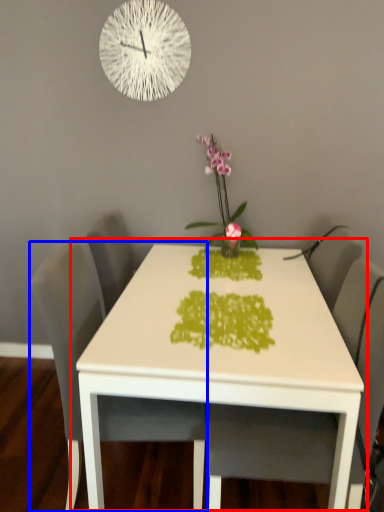
Question: Among these objects, which one is nearest to the camera, table (highlighted by a red box) or chair (highlighted by a blue box)?

Choices:
 (A) table
 (B) chair

Answer: (A)